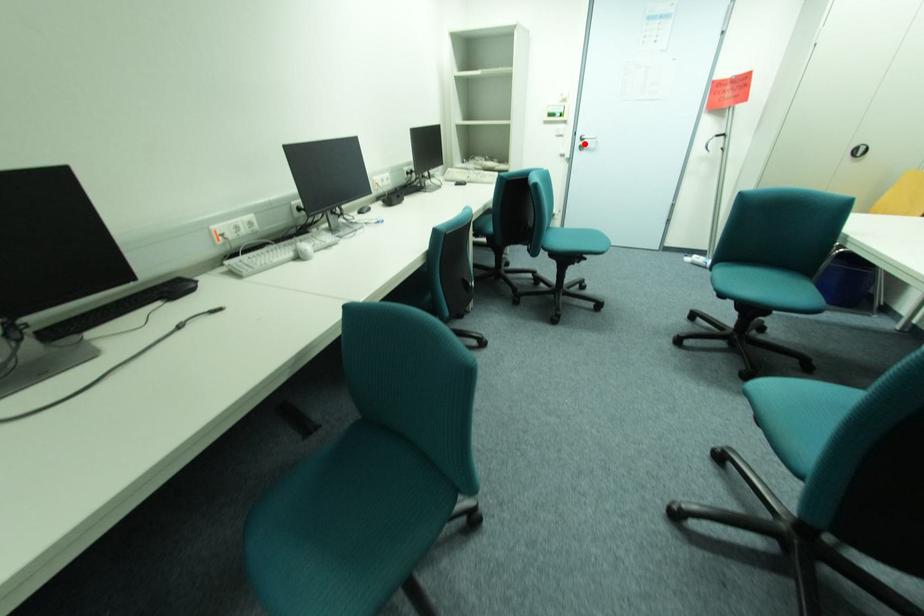
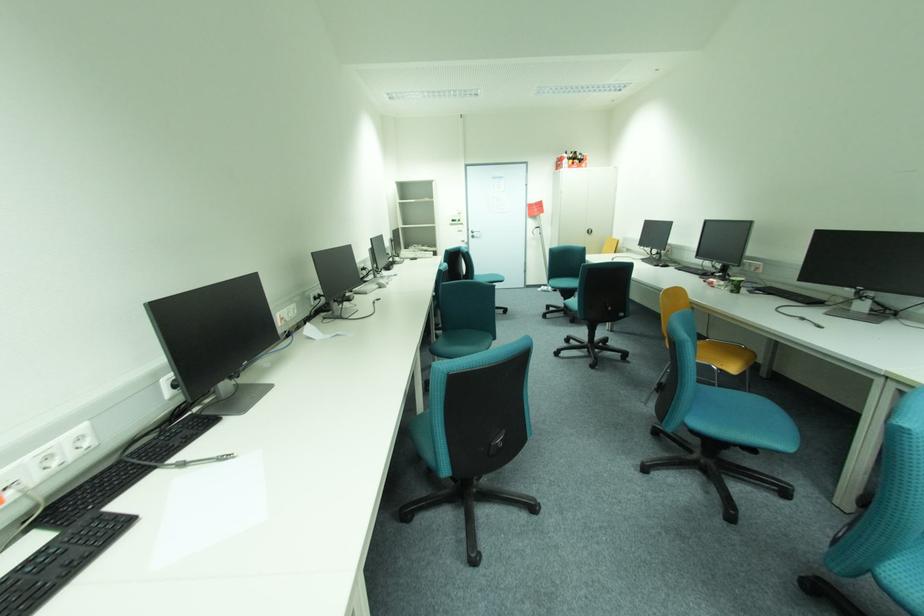
Locate, in the second image, the point that corresponds to the highlighted location in the first image.

(477, 235)